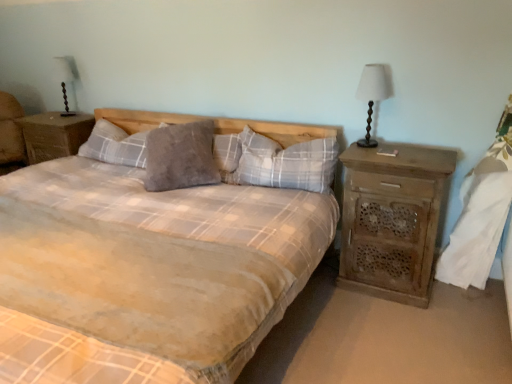
Question: Is matte black table lamp at upper left facing away from grey fuzzy pillow at center, which ranks as the 2th pillow in right-to-left order?

Choices:
 (A) no
 (B) yes

Answer: (A)

Question: Considering the relative sizes of matte black table lamp at upper left and grey fuzzy pillow at center, arranged as the second pillow when viewed from the left, in the image provided, is matte black table lamp at upper left thinner than grey fuzzy pillow at center, arranged as the second pillow when viewed from the left,?

Choices:
 (A) yes
 (B) no

Answer: (A)

Question: Does matte black table lamp at upper left touch grey fuzzy pillow at center, which ranks as the 2th pillow in right-to-left order?

Choices:
 (A) yes
 (B) no

Answer: (B)

Question: Can you confirm if matte black table lamp at upper left is wider than grey fuzzy pillow at center, arranged as the second pillow when viewed from the left?

Choices:
 (A) yes
 (B) no

Answer: (B)

Question: Is the depth of matte black table lamp at upper left less than that of grey fuzzy pillow at center, which ranks as the 2th pillow in right-to-left order?

Choices:
 (A) yes
 (B) no

Answer: (B)

Question: Does matte black table lamp at upper left have a larger size compared to grey fuzzy pillow at center, which ranks as the 2th pillow in right-to-left order?

Choices:
 (A) yes
 (B) no

Answer: (B)

Question: Is matte black table lamp at upper left bigger than gray soft pillow at center, which ranks as the 3th pillow in left-to-right order?

Choices:
 (A) yes
 (B) no

Answer: (B)

Question: Is matte black table lamp at upper left thinner than gray soft pillow at center, which ranks as the 3th pillow in left-to-right order?

Choices:
 (A) no
 (B) yes

Answer: (B)

Question: Considering the relative positions of matte black table lamp at upper left and gray soft pillow at center, which ranks as the 3th pillow in left-to-right order, in the image provided, is matte black table lamp at upper left to the right of gray soft pillow at center, which ranks as the 3th pillow in left-to-right order, from the viewer's perspective?

Choices:
 (A) no
 (B) yes

Answer: (A)

Question: Is matte black table lamp at upper left further to camera compared to gray soft pillow at center, placed as the first pillow when sorted from right to left?

Choices:
 (A) no
 (B) yes

Answer: (B)

Question: Is the position of matte black table lamp at upper left less distant than that of gray soft pillow at center, placed as the first pillow when sorted from right to left?

Choices:
 (A) yes
 (B) no

Answer: (B)

Question: Is matte black table lamp at upper left facing towards gray soft pillow at center, which ranks as the 3th pillow in left-to-right order?

Choices:
 (A) no
 (B) yes

Answer: (A)

Question: From a real-world perspective, is matte wood lamp at right below white fabric at right?

Choices:
 (A) yes
 (B) no

Answer: (B)